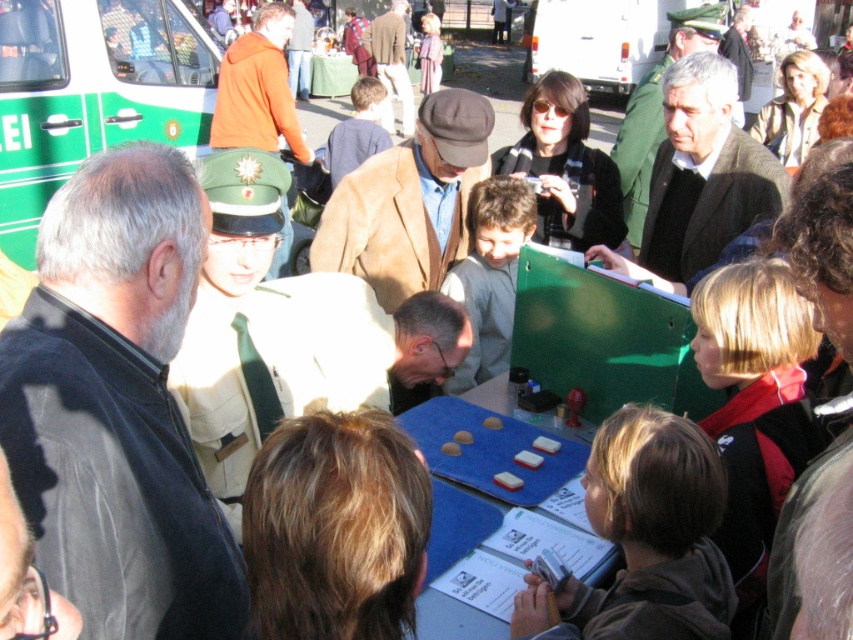
The height and width of the screenshot is (640, 853). What do you see at coordinates (409, 202) in the screenshot? I see `brown suede jacket at center` at bounding box center [409, 202].

Does brown suede jacket at center have a lesser height compared to dark brown textured jacket at center?

No, brown suede jacket at center is not shorter than dark brown textured jacket at center.

Does point (474, 156) come in front of point (698, 76)?

No.

Locate an element on the screen. This screenshot has height=640, width=853. brown suede jacket at center is located at coordinates (409, 202).

Is white uniform at center above matte brown jacket at center?

No.

Between white uniform at center and matte brown jacket at center, which one appears on the right side from the viewer's perspective?

matte brown jacket at center

Which is in front, point (212, 196) or point (660, 97)?

Positioned in front is point (212, 196).

Where is `white uniform at center`? The width and height of the screenshot is (853, 640). white uniform at center is located at coordinates (267, 332).

Who is higher up, orange jacket at center or brown leather jacket at center?

Positioned higher is brown leather jacket at center.

Between orange jacket at center and brown leather jacket at center, which one appears on the left side from the viewer's perspective?

From the viewer's perspective, orange jacket at center appears more on the left side.

Find the location of a particular element. This screenshot has height=640, width=853. orange jacket at center is located at coordinates (258, 90).

This screenshot has width=853, height=640. Find the location of `orange jacket at center`. orange jacket at center is located at coordinates (258, 90).